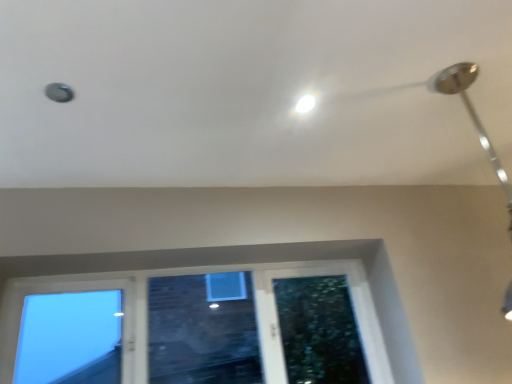
Question: Considering the relative positions of clear glass window at lower left and white glossy droplight at upper center in the image provided, is clear glass window at lower left to the left of white glossy droplight at upper center from the viewer's perspective?

Choices:
 (A) no
 (B) yes

Answer: (B)

Question: Can you confirm if clear glass window at lower left is wider than white glossy droplight at upper center?

Choices:
 (A) yes
 (B) no

Answer: (A)

Question: From the image's perspective, does clear glass window at lower left appear higher than white glossy droplight at upper center?

Choices:
 (A) yes
 (B) no

Answer: (B)

Question: Is clear glass window at lower left thinner than white glossy droplight at upper center?

Choices:
 (A) yes
 (B) no

Answer: (B)

Question: Does clear glass window at lower left come in front of white glossy droplight at upper center?

Choices:
 (A) yes
 (B) no

Answer: (B)

Question: Does clear glass window at lower left have a greater height compared to white glossy droplight at upper center?

Choices:
 (A) yes
 (B) no

Answer: (A)

Question: Considering the relative sizes of silver metallic lamp at upper right and clear glass window at lower left in the image provided, is silver metallic lamp at upper right thinner than clear glass window at lower left?

Choices:
 (A) no
 (B) yes

Answer: (A)

Question: From the image's perspective, would you say silver metallic lamp at upper right is shown under clear glass window at lower left?

Choices:
 (A) yes
 (B) no

Answer: (B)

Question: Is silver metallic lamp at upper right positioned with its back to clear glass window at lower left?

Choices:
 (A) no
 (B) yes

Answer: (A)

Question: From the image's perspective, is silver metallic lamp at upper right on top of clear glass window at lower left?

Choices:
 (A) yes
 (B) no

Answer: (A)

Question: From a real-world perspective, is silver metallic lamp at upper right over clear glass window at lower left?

Choices:
 (A) yes
 (B) no

Answer: (A)

Question: Is silver metallic lamp at upper right not within clear glass window at lower left?

Choices:
 (A) yes
 (B) no

Answer: (A)

Question: Is white glossy droplight at upper center oriented towards clear glass window at lower left?

Choices:
 (A) yes
 (B) no

Answer: (B)